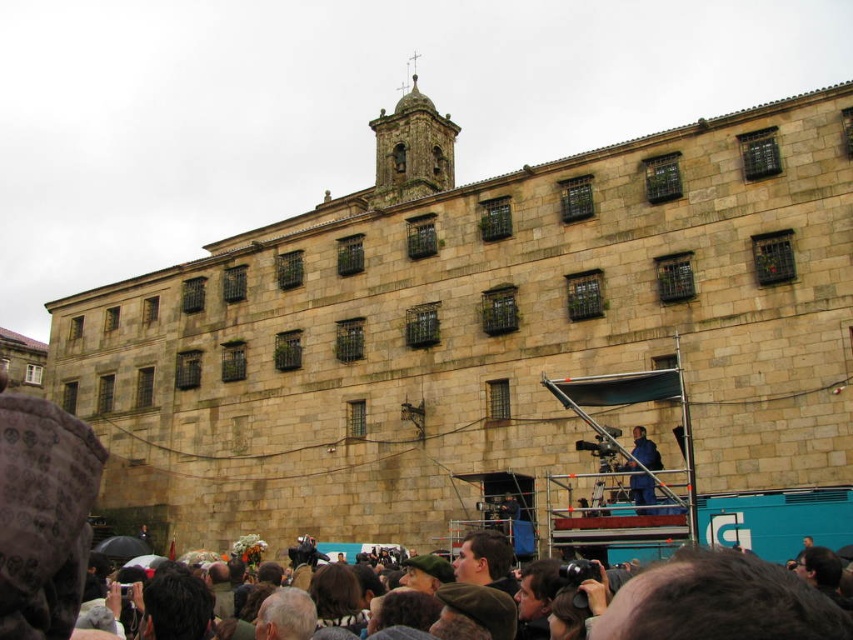
Which is in front, point (776, 627) or point (438, 132)?

Point (776, 627)

Who is positioned more to the left, dark brown hair at lower center or dark brown stone tower at upper center?

Positioned to the left is dark brown stone tower at upper center.

Between point (660, 628) and point (402, 170), which one is positioned behind?

Point (402, 170)

Identify the location of dark brown hair at lower center. pyautogui.click(x=720, y=602).

Can you confirm if dark brown stone tower at upper center is smaller than blue fabric at center?

Incorrect, dark brown stone tower at upper center is not smaller in size than blue fabric at center.

From the picture: Is dark brown stone tower at upper center closer to camera compared to blue fabric at center?

No, dark brown stone tower at upper center is further to the viewer.

This screenshot has height=640, width=853. I want to click on dark brown stone tower at upper center, so click(412, 148).

Is dark brown hair at lower center behind blue fabric at center?

No, it is not.

Who is positioned more to the right, dark brown hair at lower center or blue fabric at center?

blue fabric at center

At what (x,y) coordinates should I click in order to perform the action: click on dark brown hair at lower center. Please return your answer as a coordinate pair (x, y). This screenshot has width=853, height=640. Looking at the image, I should click on (720, 602).